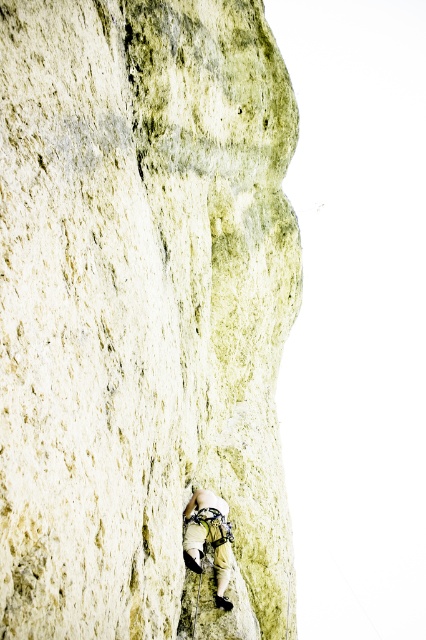
Question: Is yellowish rock at center in front of camouflage fabric harness at lower center?

Choices:
 (A) no
 (B) yes

Answer: (B)

Question: Can you confirm if yellowish rock at center is positioned to the right of camouflage fabric harness at lower center?

Choices:
 (A) no
 (B) yes

Answer: (B)

Question: Does yellowish rock at center have a larger size compared to camouflage fabric harness at lower center?

Choices:
 (A) no
 (B) yes

Answer: (B)

Question: Which point appears closest to the camera in this image?

Choices:
 (A) (187, 563)
 (B) (238, 388)

Answer: (A)